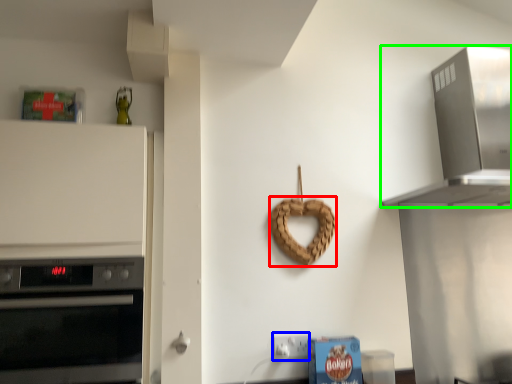
Question: Estimate the real-world distances between objects in this image. Which object is closer to pretzel (highlighted by a red box), electric outlet (highlighted by a blue box) or home appliance (highlighted by a green box)?

Choices:
 (A) electric outlet
 (B) home appliance

Answer: (A)